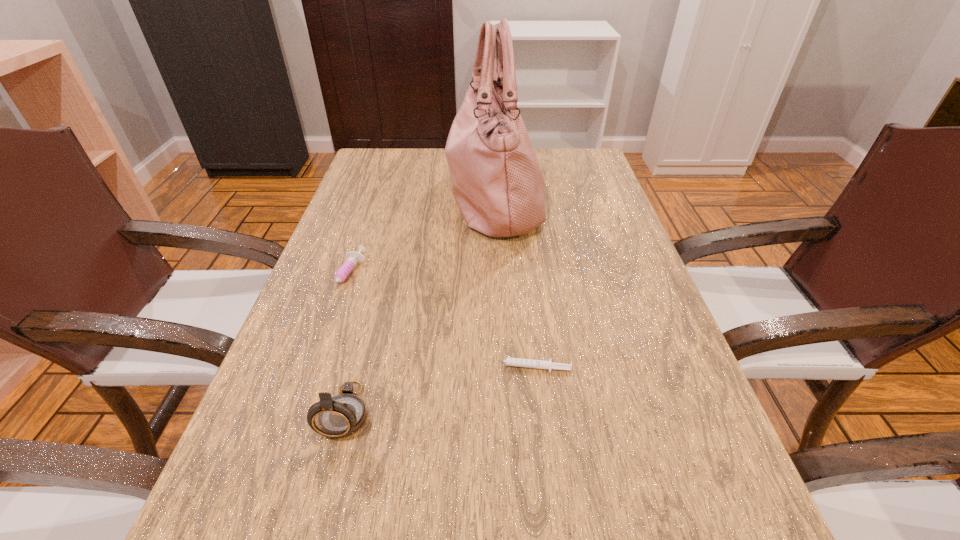
Find the location of `vacant space that's between the handbag and the right syringe`. vacant space that's between the handbag and the right syringe is located at coordinates (511, 282).

At what (x,y) coordinates should I click in order to perform the action: click on object that is the second closest one to the farthest object. Please return your answer as a coordinate pair (x, y). Looking at the image, I should click on (516, 362).

Find the location of a particular element. Image resolution: width=960 pixels, height=540 pixels. object that is the third nearest to the second farthest object is located at coordinates (516, 362).

At what (x,y) coordinates should I click in order to perform the action: click on vacant space that satisfies the following two spatial constraints: 1. at the front of the farthest object with handles; 2. on the front side of the second shortest object. Please return your answer as a coordinate pair (x, y). The height and width of the screenshot is (540, 960). Looking at the image, I should click on (498, 278).

Locate an element on the screen. vacant space that satisfies the following two spatial constraints: 1. at the front of the tallest object with handles; 2. on the left side of the third farthest object is located at coordinates (502, 368).

Locate an element on the screen. The height and width of the screenshot is (540, 960). vacant point that satisfies the following two spatial constraints: 1. at the front of the tallest object with handles; 2. on the face of the second tallest object is located at coordinates (504, 411).

The height and width of the screenshot is (540, 960). I want to click on vacant region that satisfies the following two spatial constraints: 1. at the front of the tallest object with handles; 2. on the face of the compass, so click(504, 411).

The height and width of the screenshot is (540, 960). I want to click on vacant space that satisfies the following two spatial constraints: 1. at the front of the farthest object with handles; 2. on the right side of the third farthest object, so click(502, 368).

You are a GUI agent. You are given a task and a screenshot of the screen. Output one action in this format:
    pyautogui.click(x=<x>, y=<y>)
    Task: Click on the vacant space that satisfies the following two spatial constraints: 1. on the front side of the second nearest object; 2. on the right side of the taller syringe
    
    Given the screenshot: What is the action you would take?
    pyautogui.click(x=317, y=368)

You are a GUI agent. You are given a task and a screenshot of the screen. Output one action in this format:
    pyautogui.click(x=<x>, y=<y>)
    Task: Click on the blank space that satisfies the following two spatial constraints: 1. on the front side of the taller syringe; 2. on the right side of the shorter syringe
    
    Given the screenshot: What is the action you would take?
    pyautogui.click(x=317, y=368)